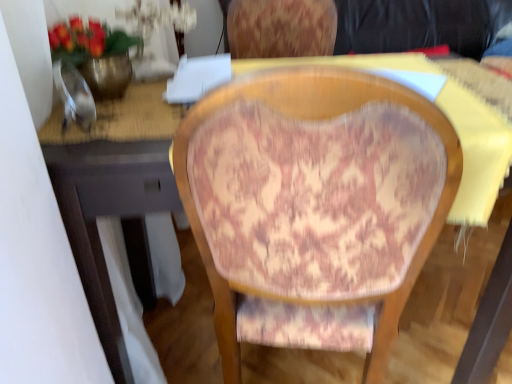
Question: Should I look upward or downward to see metallic gold vase at upper left?

Choices:
 (A) up
 (B) down

Answer: (A)

Question: Are patterned fabric chair at center and metallic gold vase at upper left beside each other?

Choices:
 (A) no
 (B) yes

Answer: (A)

Question: Is patterned fabric chair at center at the left side of metallic gold vase at upper left?

Choices:
 (A) yes
 (B) no

Answer: (B)

Question: Is patterned fabric chair at center surrounding metallic gold vase at upper left?

Choices:
 (A) yes
 (B) no

Answer: (B)

Question: Considering the relative sizes of patterned fabric chair at center and metallic gold vase at upper left in the image provided, is patterned fabric chair at center wider than metallic gold vase at upper left?

Choices:
 (A) yes
 (B) no

Answer: (A)

Question: Would you say patterned fabric chair at center is outside metallic gold vase at upper left?

Choices:
 (A) yes
 (B) no

Answer: (A)

Question: From a real-world perspective, is patterned fabric chair at center physically below metallic gold vase at upper left?

Choices:
 (A) yes
 (B) no

Answer: (A)

Question: Is metallic gold vase at upper left in contact with patterned fabric chair at center?

Choices:
 (A) yes
 (B) no

Answer: (B)

Question: Is metallic gold vase at upper left at the right side of patterned fabric chair at center?

Choices:
 (A) no
 (B) yes

Answer: (A)

Question: Is metallic gold vase at upper left smaller than patterned fabric chair at center?

Choices:
 (A) yes
 (B) no

Answer: (A)

Question: From a real-world perspective, is metallic gold vase at upper left physically above patterned fabric chair at center?

Choices:
 (A) yes
 (B) no

Answer: (A)

Question: Can you confirm if metallic gold vase at upper left is thinner than patterned fabric chair at center?

Choices:
 (A) no
 (B) yes

Answer: (B)

Question: From the image's perspective, is metallic gold vase at upper left over patterned fabric chair at center?

Choices:
 (A) no
 (B) yes

Answer: (B)

Question: In terms of width, does patterned fabric chair at center look wider or thinner when compared to metallic gold vase at upper left?

Choices:
 (A) wide
 (B) thin

Answer: (A)